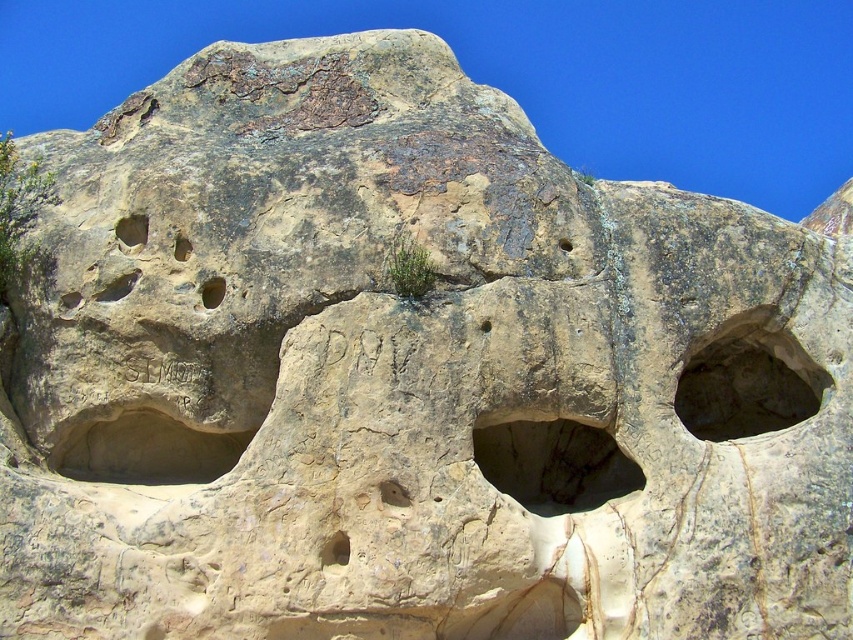
Question: Does dark brown stone hole at right have a smaller size compared to yellow rock hole at center?

Choices:
 (A) no
 (B) yes

Answer: (A)

Question: Which object appears closest to the camera in this image?

Choices:
 (A) rough stone hole at center
 (B) yellow rock hole at center

Answer: (A)

Question: Which object is positioned farthest from the yellowish rock hole at upper left?

Choices:
 (A) brown rough hole at upper left
 (B) smooth beige rock at upper left
 (C) dark brown stone hole at right
 (D) rough stone hole at center

Answer: (C)

Question: Is smooth beige rock at center bigger than yellow rock hole at center?

Choices:
 (A) no
 (B) yes

Answer: (A)

Question: Where is yellow rock hole at center located in relation to smooth beige rock at upper left in the image?

Choices:
 (A) left
 (B) right

Answer: (B)

Question: Which object is positioned farthest from the yellow rock hole at center?

Choices:
 (A) yellowish rock hole at upper left
 (B) smooth beige rock at upper left

Answer: (B)